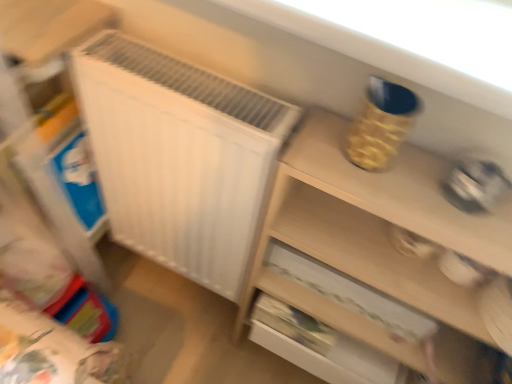
I want to click on free spot above light wood chest of drawers at upper right (from a real-world perspective), so click(x=421, y=185).